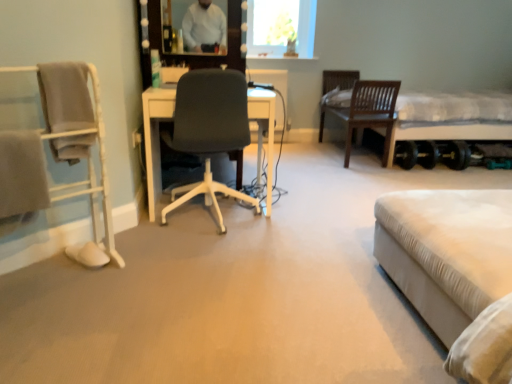
Find the location of a particular element. This screenshot has width=512, height=384. space that is in front of black fabric chair at center, which is counted as the 2th chair, starting from the back is located at coordinates (212, 259).